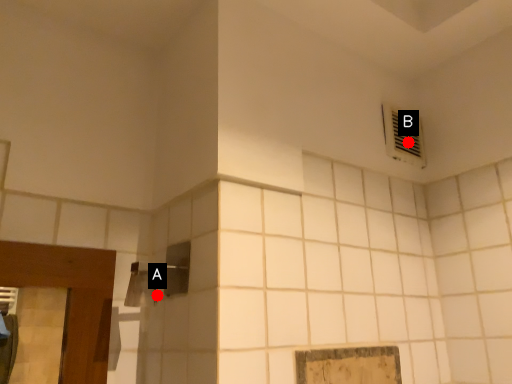
Question: Two points are circled on the image, labeled by A and B beside each circle. Which point is closer to the camera?

Choices:
 (A) A is closer
 (B) B is closer

Answer: (A)